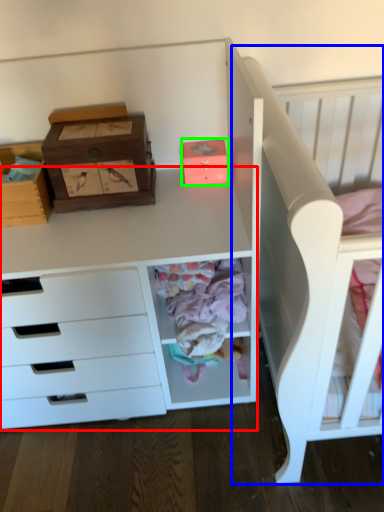
Question: Considering the real-world distances, which object is farthest from computer desk (highlighted by a red box)? bed (highlighted by a blue box) or shoe box (highlighted by a green box)?

Choices:
 (A) bed
 (B) shoe box

Answer: (B)